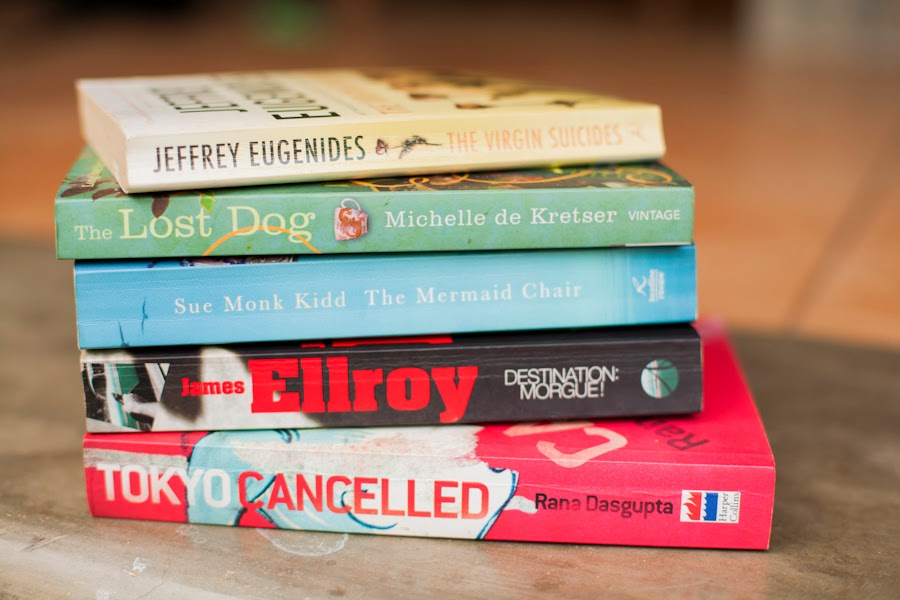
At what (x,y) coordinates should I click in order to perform the action: click on books. Please return your answer as a coordinate pair (x, y). This screenshot has width=900, height=600. Looking at the image, I should click on (304, 464), (303, 389), (303, 291), (295, 220), (290, 143).